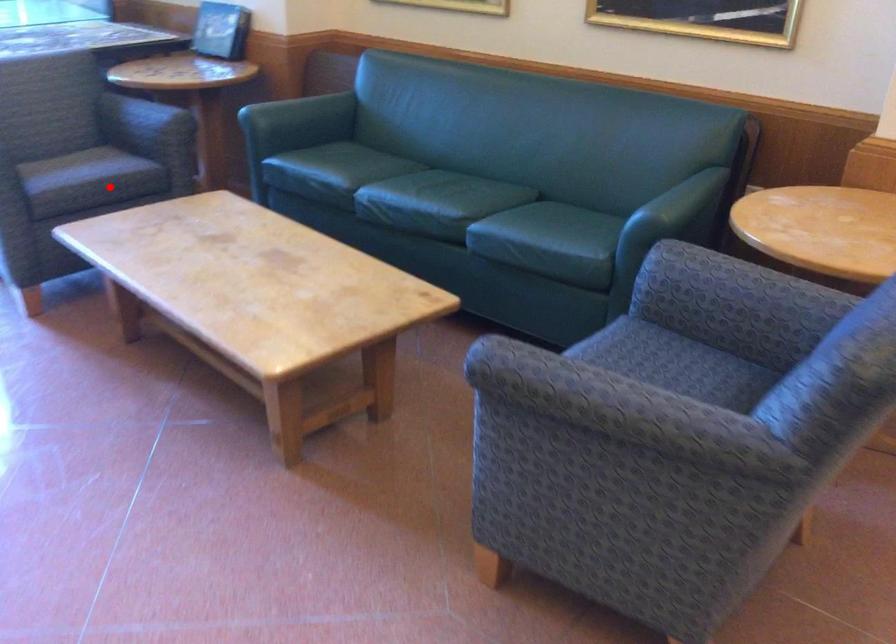
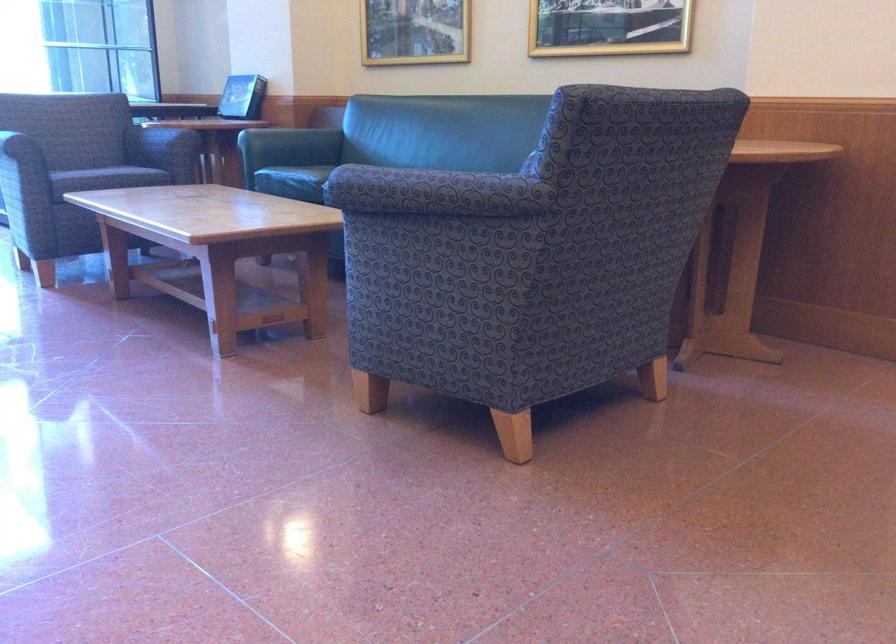
In the second image, find the point that corresponds to the highlighted location in the first image.

(115, 176)